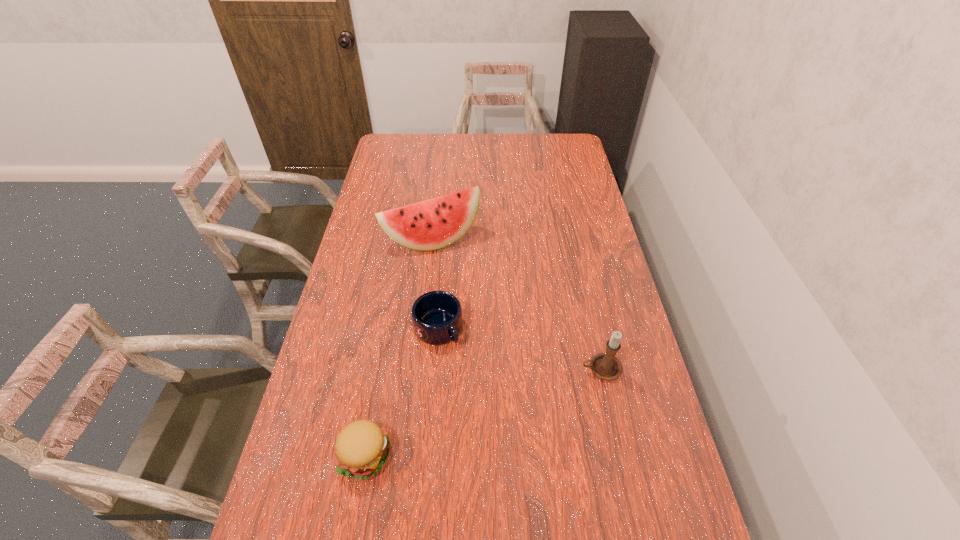
You are a GUI agent. You are given a task and a screenshot of the screen. Output one action in this format:
    pyautogui.click(x=<x>, y=<y>)
    Task: Click on the hamburger
    
    Given the screenshot: What is the action you would take?
    pyautogui.click(x=361, y=448)

Locate an element on the screen. The width and height of the screenshot is (960, 540). the rightmost object is located at coordinates (606, 366).

Identify the location of candle holder. (606, 366).

Find the location of a particular element. This screenshot has width=960, height=540. the tallest object is located at coordinates (435, 223).

At what (x,y) coordinates should I click in order to perform the action: click on the farthest object. Please return your answer as a coordinate pair (x, y). Looking at the image, I should click on (435, 223).

Locate an element on the screen. This screenshot has height=540, width=960. mug is located at coordinates (436, 315).

I want to click on vacant space situated 0.090m on the front of the hamburger, so click(351, 526).

At what (x,y) coordinates should I click in order to perform the action: click on vacant region located on the side of the second tallest object with the handle. Please return your answer as a coordinate pair (x, y). The width and height of the screenshot is (960, 540). Looking at the image, I should click on (556, 369).

Find the location of `vacant space located on the side of the second tallest object with the handle`. vacant space located on the side of the second tallest object with the handle is located at coordinates (496, 369).

Where is `free space located 0.210m on the side of the second tallest object with the handle`? free space located 0.210m on the side of the second tallest object with the handle is located at coordinates (507, 369).